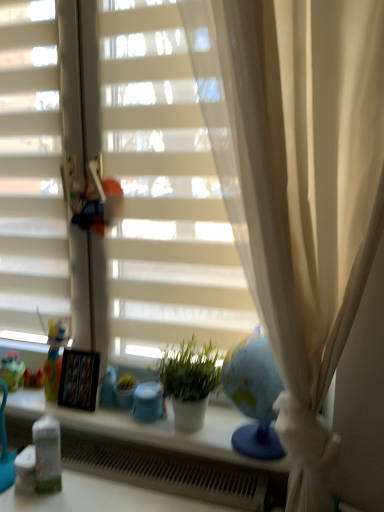
Question: Is white matte shutter at left wider than matte green toy at left?

Choices:
 (A) no
 (B) yes

Answer: (A)

Question: From a real-world perspective, is white matte shutter at left located higher than matte green toy at left?

Choices:
 (A) no
 (B) yes

Answer: (B)

Question: Does white matte shutter at left have a larger size compared to matte green toy at left?

Choices:
 (A) yes
 (B) no

Answer: (A)

Question: Can we say white matte shutter at left lies outside matte green toy at left?

Choices:
 (A) no
 (B) yes

Answer: (B)

Question: Is white matte shutter at left positioned far away from matte green toy at left?

Choices:
 (A) no
 (B) yes

Answer: (A)

Question: From the image's perspective, is white matte shutter at left located beneath matte green toy at left?

Choices:
 (A) no
 (B) yes

Answer: (A)

Question: Does matte green toy at left lie in front of white plastic radiator at lower center?

Choices:
 (A) no
 (B) yes

Answer: (A)

Question: Is matte green toy at left smaller than white plastic radiator at lower center?

Choices:
 (A) no
 (B) yes

Answer: (B)

Question: From the image's perspective, does matte green toy at left appear higher than white plastic radiator at lower center?

Choices:
 (A) no
 (B) yes

Answer: (B)

Question: Is matte green toy at left oriented towards white plastic radiator at lower center?

Choices:
 (A) yes
 (B) no

Answer: (B)

Question: Considering the relative sizes of matte green toy at left and white plastic radiator at lower center in the image provided, is matte green toy at left shorter than white plastic radiator at lower center?

Choices:
 (A) yes
 (B) no

Answer: (A)

Question: Is matte green toy at left facing away from white plastic radiator at lower center?

Choices:
 (A) yes
 (B) no

Answer: (B)

Question: Does matte plastic doll at left have a greater width compared to white matte blinds at center?

Choices:
 (A) yes
 (B) no

Answer: (A)